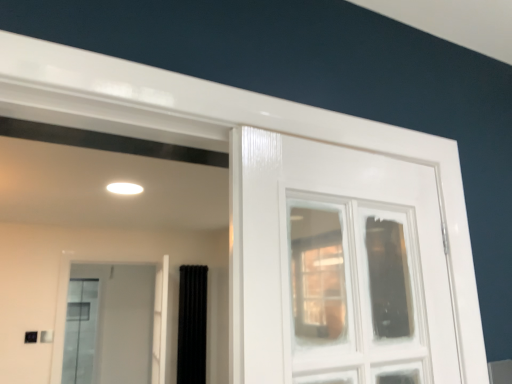
Question: Is clear glass window at center positioned in front of black velvet curtain at center?

Choices:
 (A) yes
 (B) no

Answer: (A)

Question: From the image's perspective, is clear glass window at center beneath black velvet curtain at center?

Choices:
 (A) yes
 (B) no

Answer: (B)

Question: Considering the relative positions of clear glass window at center and black velvet curtain at center in the image provided, is clear glass window at center to the left of black velvet curtain at center from the viewer's perspective?

Choices:
 (A) yes
 (B) no

Answer: (B)

Question: Could you tell me if clear glass window at center is facing black velvet curtain at center?

Choices:
 (A) no
 (B) yes

Answer: (A)

Question: Is clear glass window at center turned away from black velvet curtain at center?

Choices:
 (A) no
 (B) yes

Answer: (A)

Question: Is black velvet curtain at center taller or shorter than clear glass screen door at upper left?

Choices:
 (A) tall
 (B) short

Answer: (B)

Question: Is black velvet curtain at center bigger or smaller than clear glass screen door at upper left?

Choices:
 (A) small
 (B) big

Answer: (A)

Question: From the image's perspective, is black velvet curtain at center positioned above or below clear glass screen door at upper left?

Choices:
 (A) below
 (B) above

Answer: (A)

Question: Relative to clear glass screen door at upper left, is black velvet curtain at center in front or behind?

Choices:
 (A) behind
 (B) front

Answer: (A)

Question: From the image's perspective, relative to black velvet curtain at center, is clear glass window at center above or below?

Choices:
 (A) above
 (B) below

Answer: (A)

Question: Considering the positions of clear glass window at center and black velvet curtain at center in the image, is clear glass window at center taller or shorter than black velvet curtain at center?

Choices:
 (A) short
 (B) tall

Answer: (A)

Question: Relative to black velvet curtain at center, is clear glass window at center in front or behind?

Choices:
 (A) behind
 (B) front

Answer: (B)

Question: In terms of width, does clear glass window at center look wider or thinner when compared to black velvet curtain at center?

Choices:
 (A) wide
 (B) thin

Answer: (B)

Question: Looking at their shapes, would you say clear glass window at center is wider or thinner than clear glass screen door at upper left?

Choices:
 (A) wide
 (B) thin

Answer: (B)

Question: Does point (390, 286) appear closer or farther from the camera than point (77, 352)?

Choices:
 (A) farther
 (B) closer

Answer: (B)